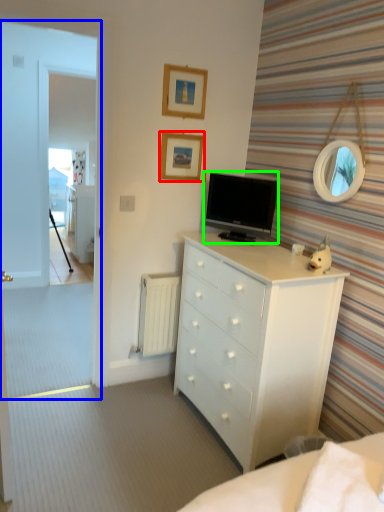
Question: Which object is positioned farthest from picture frame (highlighted by a red box)? Select from glass door (highlighted by a blue box) and television (highlighted by a green box).

Choices:
 (A) glass door
 (B) television

Answer: (A)